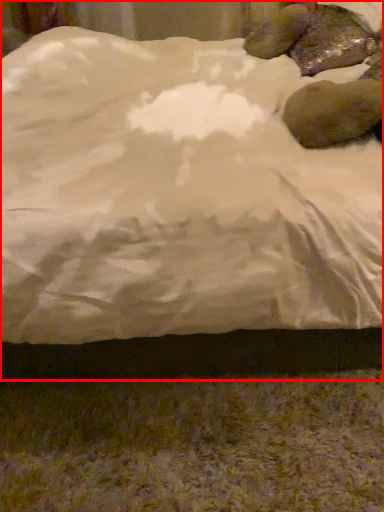
Question: Considering the relative positions of bed (annotated by the red box) and animal in the image provided, where is bed (annotated by the red box) located with respect to the staircase?

Choices:
 (A) left
 (B) right

Answer: (A)